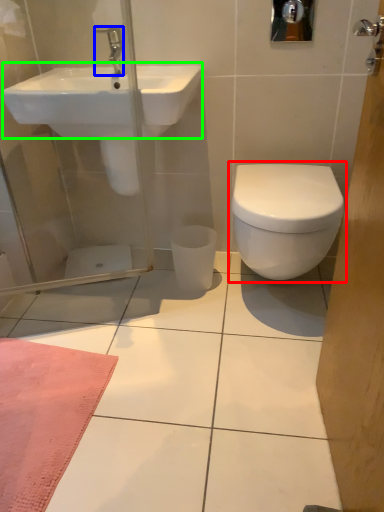
Question: Which object is the closest to the toilet (highlighted by a red box)? Choose among these: tap (highlighted by a blue box) or sink (highlighted by a green box).

Choices:
 (A) tap
 (B) sink

Answer: (B)